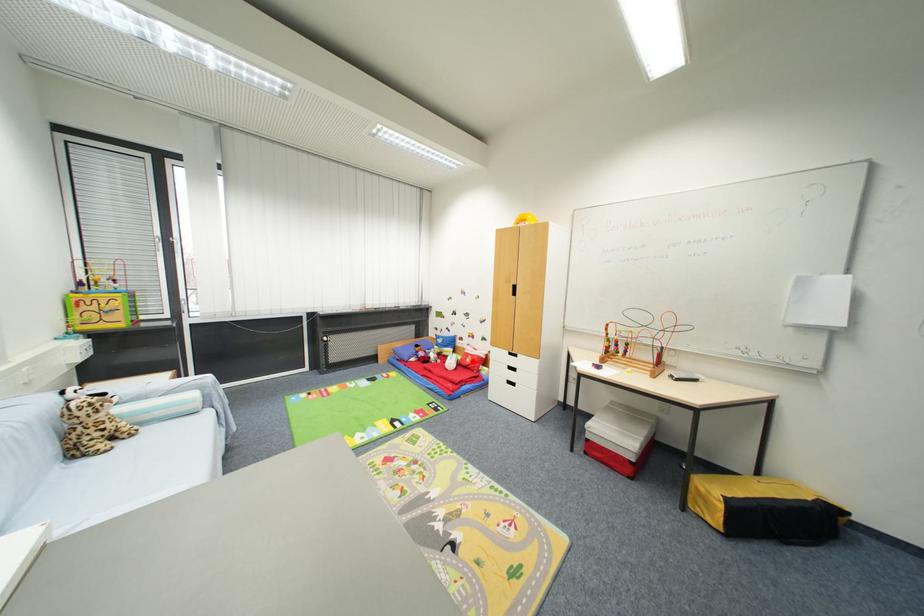
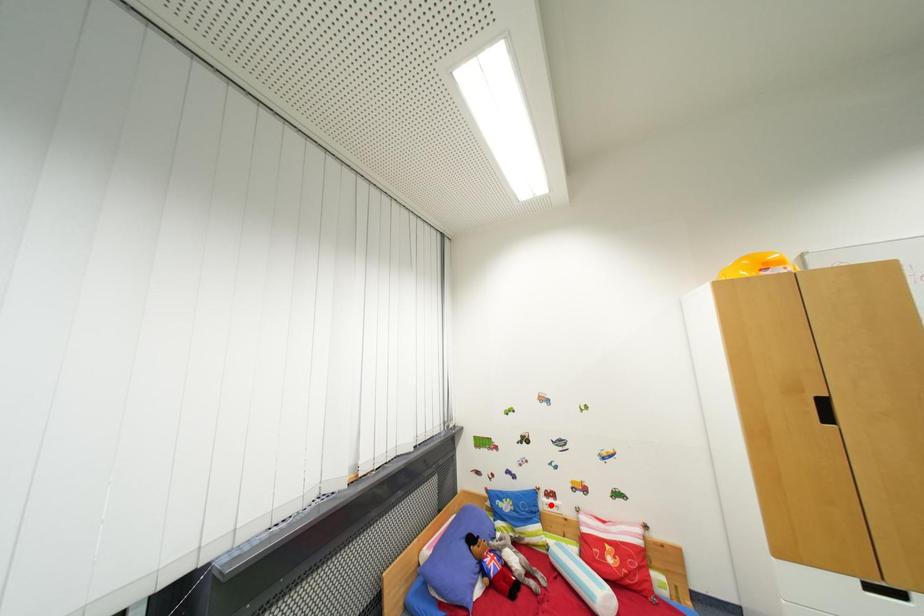
I am providing you with two images of the same scene from different viewpoints. A red point is marked on the first image and another point is marked on the second image. Is the marked point in image1 the same physical position as the marked point in image2?

No